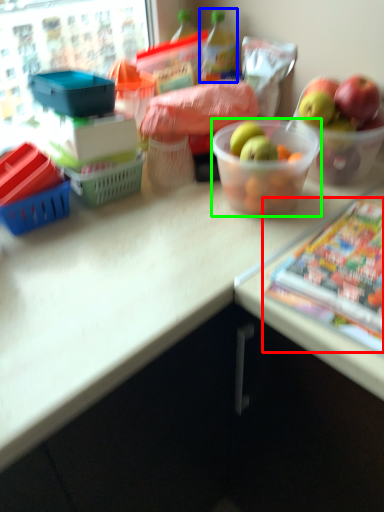
Question: Which object is the farthest from comic book (highlighted by a red box)? Choose among these: bottle (highlighted by a blue box) or bowl (highlighted by a green box).

Choices:
 (A) bottle
 (B) bowl

Answer: (A)